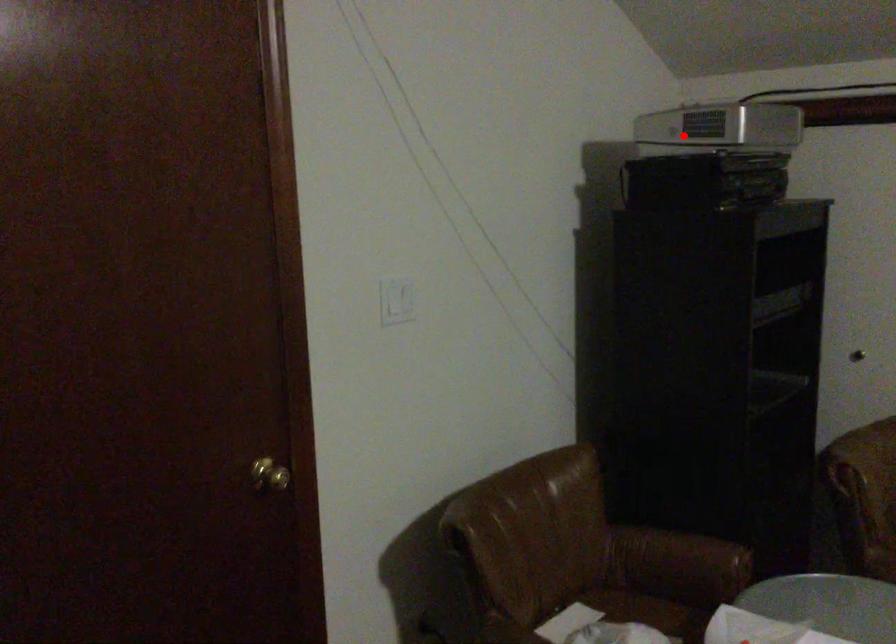
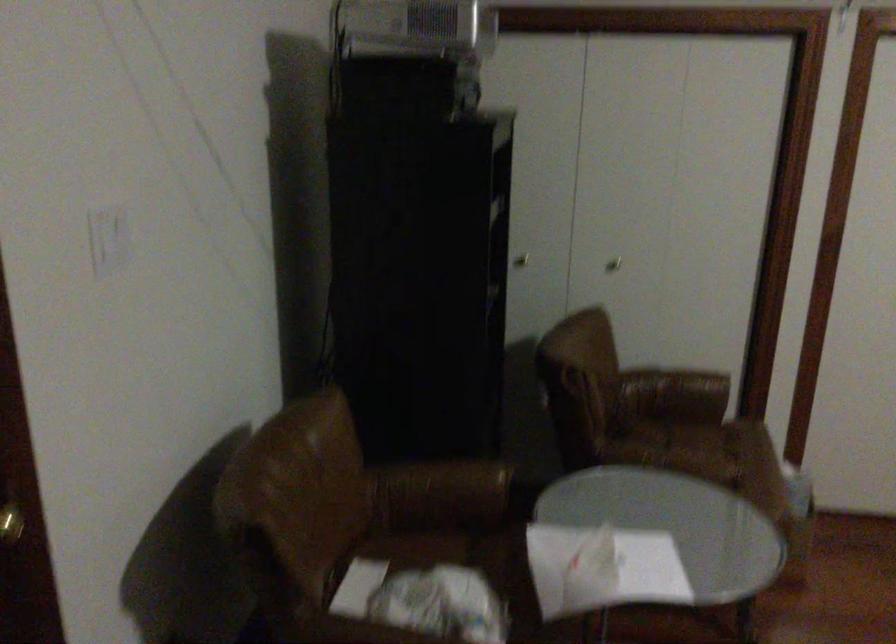
Find the pixel in the second image that matches the highlighted location in the first image.

(412, 26)